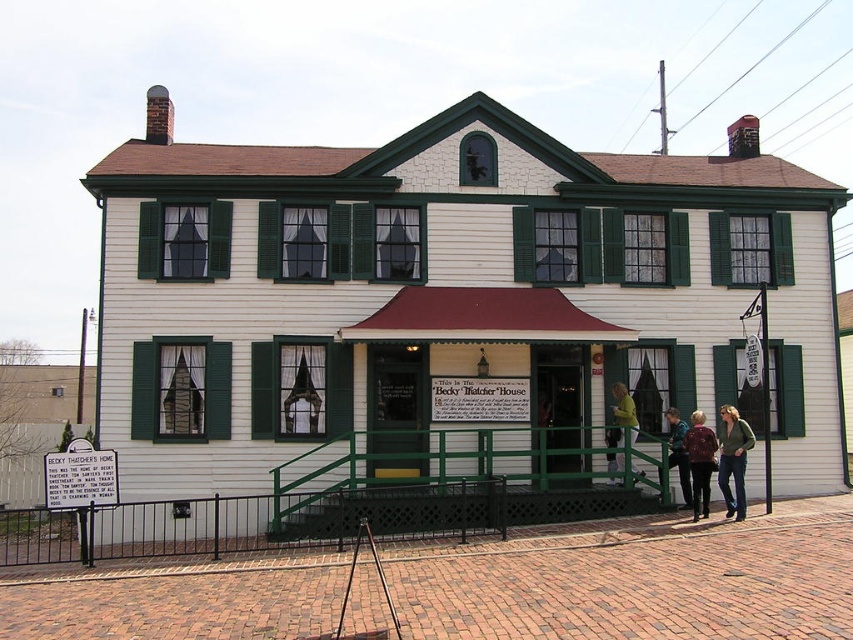
Question: Based on their relative distances, which object is nearer to the matte green jacket at lower right?

Choices:
 (A) yellow fabric at center
 (B) green cotton shirt at center
 (C) white wood house at center

Answer: (A)

Question: Which object appears farthest from the camera in this image?

Choices:
 (A) yellow fabric at center
 (B) white wood house at center
 (C) floral-patterned sweater at lower right

Answer: (A)

Question: Can you confirm if white wood house at center is positioned above dark brown leather jacket at lower right?

Choices:
 (A) yes
 (B) no

Answer: (A)

Question: Is white wood house at center wider than green cotton shirt at center?

Choices:
 (A) no
 (B) yes

Answer: (B)

Question: Can you confirm if floral-patterned sweater at lower right is positioned below matte green jacket at lower right?

Choices:
 (A) yes
 (B) no

Answer: (A)

Question: Which point is closer to the camera?

Choices:
 (A) (729, 406)
 (B) (735, 426)
 (C) (833, 435)
 (D) (703, 483)

Answer: (D)